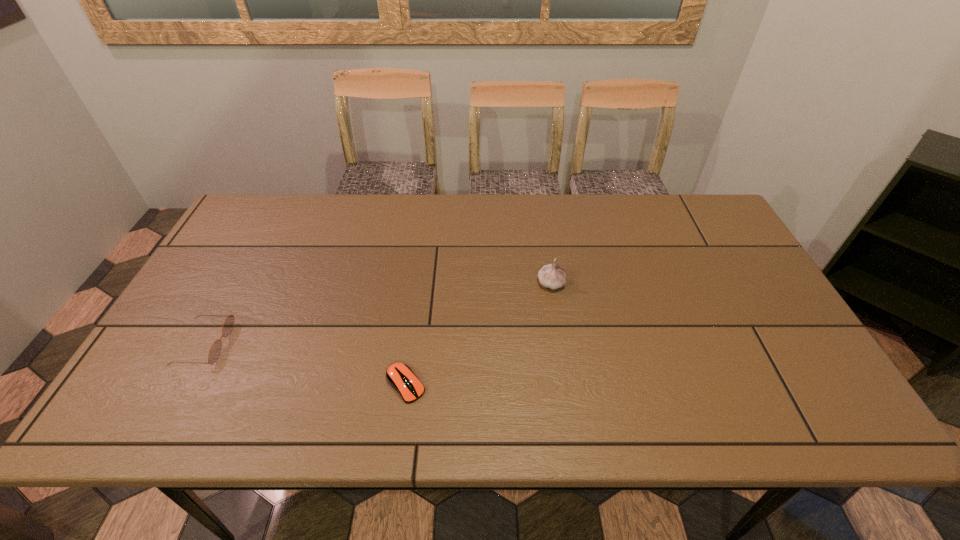
Where is `object positioned at the left edge`? object positioned at the left edge is located at coordinates (215, 349).

The height and width of the screenshot is (540, 960). Identify the location of free space at the far edge of the desktop. (284, 234).

Image resolution: width=960 pixels, height=540 pixels. I want to click on free space at the near edge, so click(562, 423).

Where is `vacant space at the left edge of the desktop`? The width and height of the screenshot is (960, 540). vacant space at the left edge of the desktop is located at coordinates (221, 288).

Find the location of a particular element. This screenshot has height=540, width=960. vacant space at the right edge is located at coordinates (728, 318).

In the image, there is a desktop. Where is `free region at the far left corner`? free region at the far left corner is located at coordinates (283, 218).

What are the coordinates of `free spot at the far right corner of the desktop` in the screenshot? It's located at (694, 215).

Image resolution: width=960 pixels, height=540 pixels. Identify the location of free point between the garlic and the second shortest object. (377, 313).

Find the location of a particular element. This screenshot has width=960, height=540. blank region between the computer mouse and the rightmost object is located at coordinates (478, 334).

Locate an element on the screen. The image size is (960, 540). vacant space that's between the rightmost object and the shortest object is located at coordinates (478, 334).